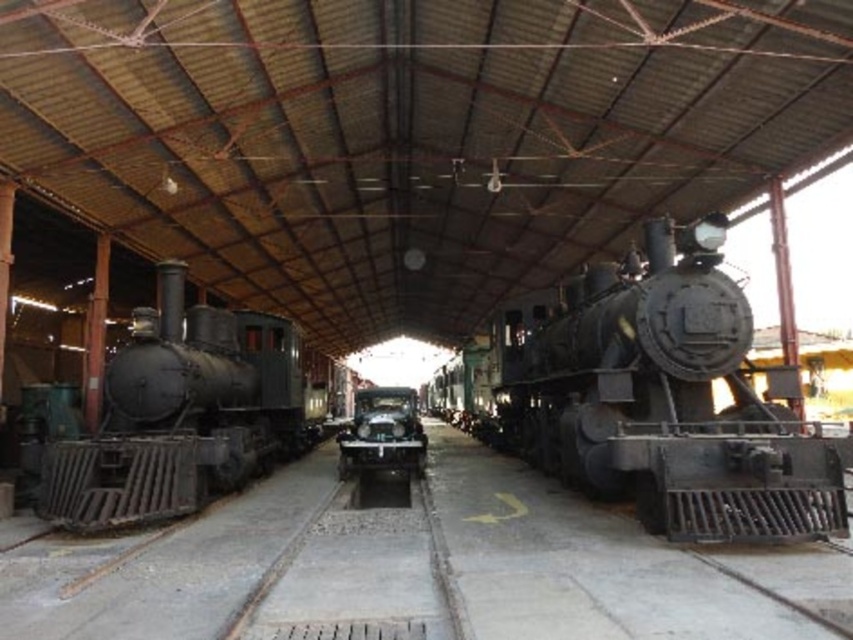
Question: Considering the relative positions of matte black locomotive at left and shiny silver car at center in the image provided, where is matte black locomotive at left located with respect to shiny silver car at center?

Choices:
 (A) below
 (B) above

Answer: (B)

Question: Observing the image, what is the correct spatial positioning of matte black locomotive at left in reference to shiny silver car at center?

Choices:
 (A) below
 (B) above

Answer: (B)

Question: Which of the following is the closest to the observer?

Choices:
 (A) matte black locomotive at left
 (B) shiny silver car at center

Answer: (A)

Question: Is matte black locomotive at left above shiny silver car at center?

Choices:
 (A) yes
 (B) no

Answer: (A)